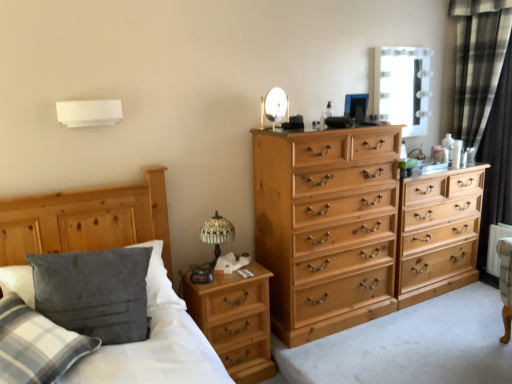
Question: Does velvety gray pillow at lower left have a greater height compared to black plaid curtain at right?

Choices:
 (A) no
 (B) yes

Answer: (A)

Question: Is velvety gray pillow at lower left looking in the opposite direction of black plaid curtain at right?

Choices:
 (A) yes
 (B) no

Answer: (B)

Question: Considering the relative positions of velvety gray pillow at lower left and black plaid curtain at right in the image provided, is velvety gray pillow at lower left to the left of black plaid curtain at right from the viewer's perspective?

Choices:
 (A) no
 (B) yes

Answer: (B)

Question: Is velvety gray pillow at lower left in contact with black plaid curtain at right?

Choices:
 (A) no
 (B) yes

Answer: (A)

Question: From a real-world perspective, is velvety gray pillow at lower left on top of black plaid curtain at right?

Choices:
 (A) yes
 (B) no

Answer: (B)

Question: Considering the positions of natural wood chest of drawers at right, the 1th chest of drawers viewed from the right, and metallic round mirror at upper center in the image, is natural wood chest of drawers at right, the 1th chest of drawers viewed from the right, bigger or smaller than metallic round mirror at upper center?

Choices:
 (A) big
 (B) small

Answer: (A)

Question: Looking at their shapes, would you say natural wood chest of drawers at right, the 1th chest of drawers viewed from the right, is wider or thinner than metallic round mirror at upper center?

Choices:
 (A) wide
 (B) thin

Answer: (A)

Question: Is natural wood chest of drawers at right, arranged as the second chest of drawers when viewed from the left, in front of or behind metallic round mirror at upper center in the image?

Choices:
 (A) front
 (B) behind

Answer: (B)

Question: From the image's perspective, is natural wood chest of drawers at right, the 1th chest of drawers viewed from the right, positioned above or below metallic round mirror at upper center?

Choices:
 (A) above
 (B) below

Answer: (B)

Question: From a real-world perspective, is metallic round mirror at upper center positioned above or below natural wood chest of drawers at right, the 1th chest of drawers viewed from the right?

Choices:
 (A) above
 (B) below

Answer: (A)

Question: Considering the positions of metallic round mirror at upper center and natural wood chest of drawers at right, the 1th chest of drawers viewed from the right, in the image, is metallic round mirror at upper center taller or shorter than natural wood chest of drawers at right, the 1th chest of drawers viewed from the right,?

Choices:
 (A) short
 (B) tall

Answer: (A)

Question: Is metallic round mirror at upper center wider or thinner than natural wood chest of drawers at right, the 1th chest of drawers viewed from the right?

Choices:
 (A) wide
 (B) thin

Answer: (B)

Question: Is point (272, 120) positioned closer to the camera than point (454, 210)?

Choices:
 (A) farther
 (B) closer

Answer: (B)

Question: From the image's perspective, relative to white glossy mirror at upper right, is metallic round mirror at upper center above or below?

Choices:
 (A) above
 (B) below

Answer: (B)

Question: Based on their sizes in the image, would you say metallic round mirror at upper center is bigger or smaller than white glossy mirror at upper right?

Choices:
 (A) small
 (B) big

Answer: (A)